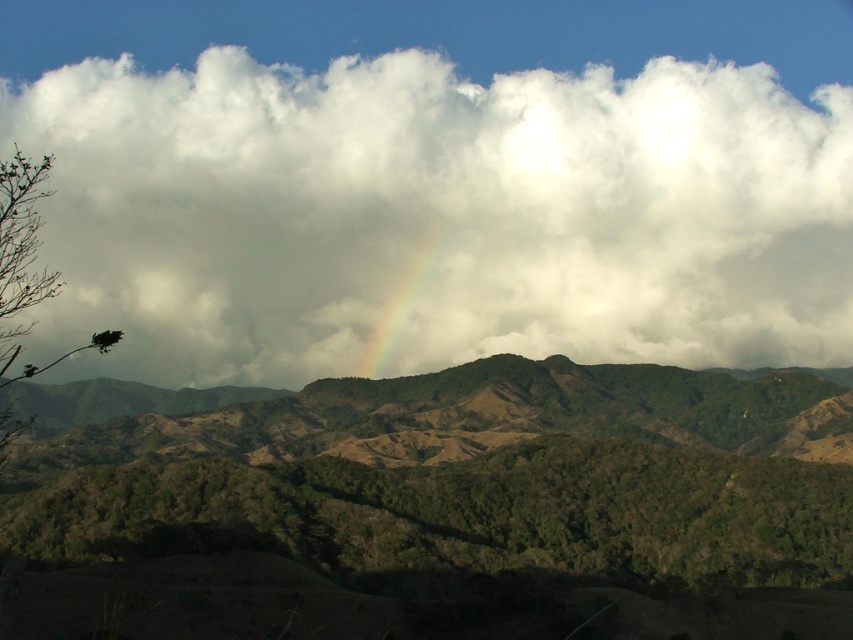
Question: Is green leafy tree at center bigger than brown textured tree at left?

Choices:
 (A) no
 (B) yes

Answer: (A)

Question: Which of the following is the closest to the observer?

Choices:
 (A) (811, 448)
 (B) (424, 253)
 (C) (606, 131)
 (D) (38, 372)

Answer: (A)

Question: Can you confirm if brown textured tree at left is positioned to the right of rainbow at center?

Choices:
 (A) yes
 (B) no

Answer: (B)

Question: Is green textured hillside at center wider than brown textured tree at left?

Choices:
 (A) yes
 (B) no

Answer: (A)

Question: Estimate the real-world distances between objects in this image. Which object is farther from the rainbow at center?

Choices:
 (A) brown textured tree at left
 (B) green leafy tree at center

Answer: (B)

Question: Estimate the real-world distances between objects in this image. Which object is closer to the green leafy tree at center?

Choices:
 (A) brown textured tree at left
 (B) white fluffy cloud at upper center
 (C) rainbow at center

Answer: (A)